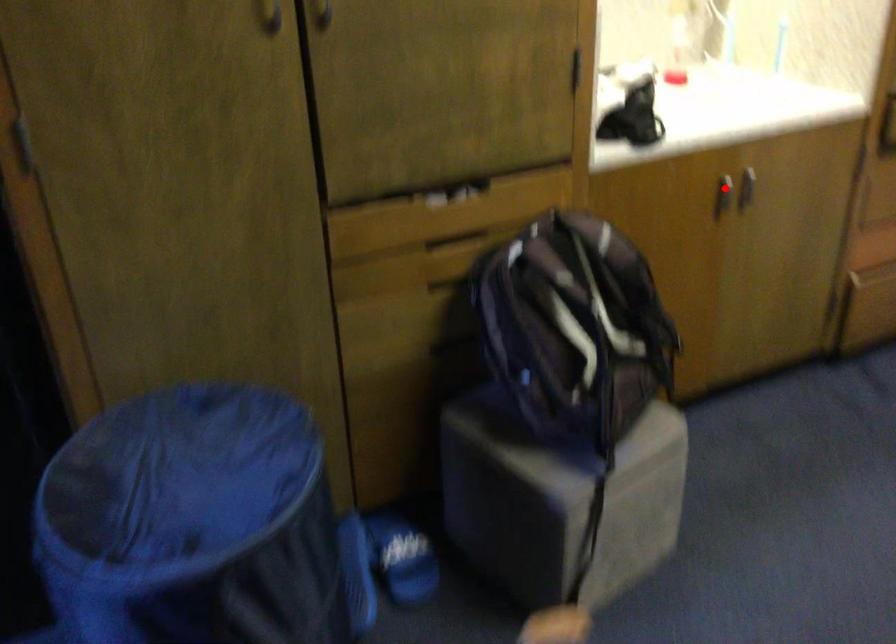
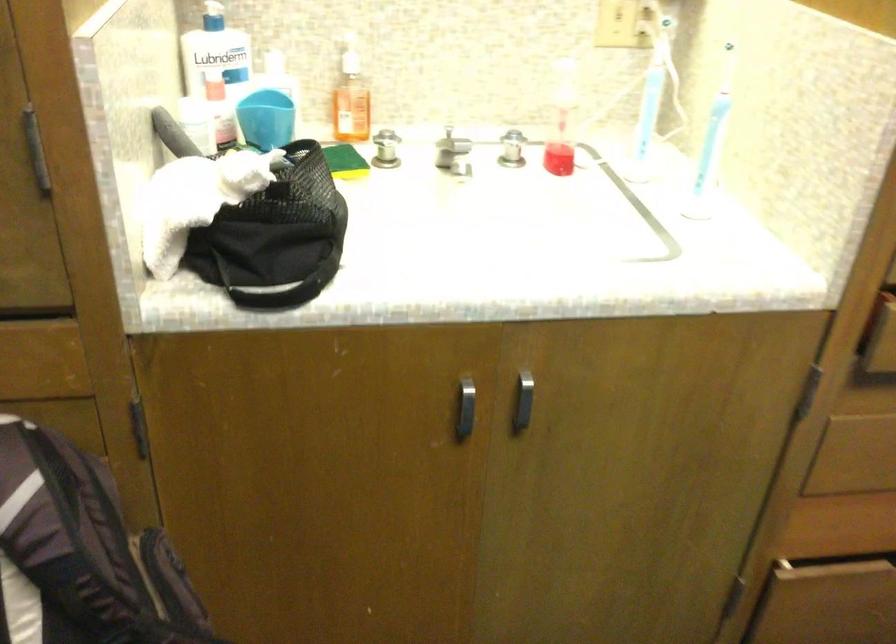
Question: I am providing you with two images of the same scene from different viewpoints. A red point is marked on the first image. At the location where the point appears in image 1, is it still visible in image 2?

Choices:
 (A) Yes
 (B) No

Answer: (A)